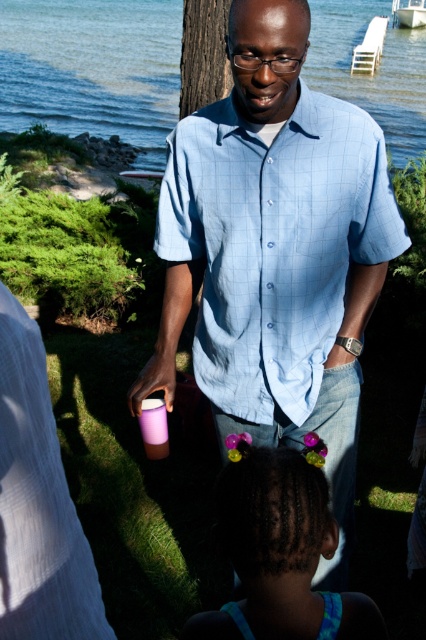
You are a photographer trying to capture both the light blue checkered shirt at center and the purple hairband at lower center in a single shot. Which object should you focus on first to ensure both are in clear view?

You should focus on the light blue checkered shirt at center first because it is closer to you than the purple hairband at lower center, ensuring both will be in focus when focused on the closer object.

You are organizing a picnic and need to place a small basket on the picnic blanket. The picnic blanket is positioned such that its edge aligns with the point where the purple hairband at lower center is located. Can you confirm if the basket will fit entirely within the blanket if the basket has a diameter of 30 cm?

The purple hairband at lower center is located at point (281, 550). Since the basket has a diameter of 30 cm, it will fit entirely within the blanket as long as the blanket extends beyond this point by at least 15 cm in all directions from the edge aligned with the hairband.